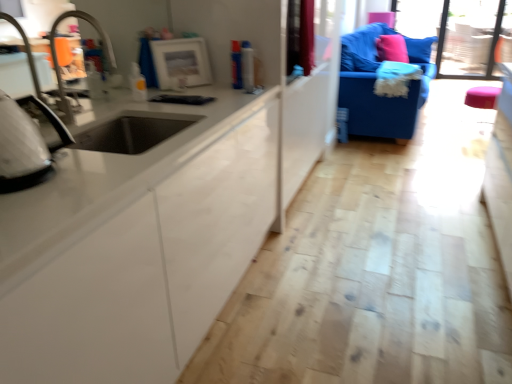
Question: Is blue fabric couch at upper right located outside brushed metal faucet at left?

Choices:
 (A) yes
 (B) no

Answer: (A)

Question: Considering the relative positions of blue fabric couch at upper right and brushed metal faucet at left in the image provided, is blue fabric couch at upper right to the left of brushed metal faucet at left from the viewer's perspective?

Choices:
 (A) no
 (B) yes

Answer: (A)

Question: Is blue fabric couch at upper right shorter than brushed metal faucet at left?

Choices:
 (A) no
 (B) yes

Answer: (A)

Question: Considering the relative positions of blue fabric couch at upper right and brushed metal faucet at left in the image provided, is blue fabric couch at upper right to the right of brushed metal faucet at left from the viewer's perspective?

Choices:
 (A) yes
 (B) no

Answer: (A)

Question: Considering the relative positions of blue fabric couch at upper right and brushed metal faucet at left in the image provided, is blue fabric couch at upper right in front of brushed metal faucet at left?

Choices:
 (A) no
 (B) yes

Answer: (A)

Question: Is blue fabric couch at upper right thinner than brushed metal faucet at left?

Choices:
 (A) no
 (B) yes

Answer: (A)

Question: From a real-world perspective, does transparent glass window screen at upper right sit lower than matte white frame at upper center, the first appliance from the back?

Choices:
 (A) no
 (B) yes

Answer: (B)

Question: Is transparent glass window screen at upper right located outside matte white frame at upper center, placed as the second appliance when sorted from left to right?

Choices:
 (A) yes
 (B) no

Answer: (A)

Question: Is transparent glass window screen at upper right next to matte white frame at upper center, placed as the second appliance when sorted from left to right?

Choices:
 (A) no
 (B) yes

Answer: (A)

Question: Can you confirm if transparent glass window screen at upper right is thinner than matte white frame at upper center, placed as the second appliance when sorted from left to right?

Choices:
 (A) no
 (B) yes

Answer: (A)

Question: Is transparent glass window screen at upper right far away from matte white frame at upper center, which ranks as the 2th appliance in front-to-back order?

Choices:
 (A) no
 (B) yes

Answer: (B)

Question: From the image's perspective, is transparent glass window screen at upper right located above matte white frame at upper center, the first appliance from the back?

Choices:
 (A) no
 (B) yes

Answer: (B)

Question: Considering the relative positions of white glossy iron at left, the 2th appliance in the right-to-left sequence, and transparent glass window screen at upper right in the image provided, is white glossy iron at left, the 2th appliance in the right-to-left sequence, to the left of transparent glass window screen at upper right from the viewer's perspective?

Choices:
 (A) no
 (B) yes

Answer: (B)